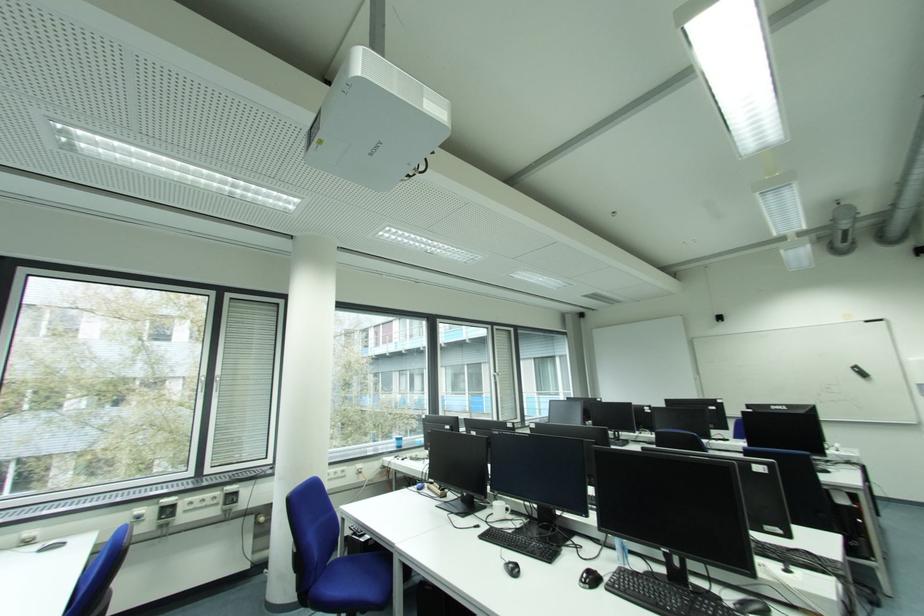
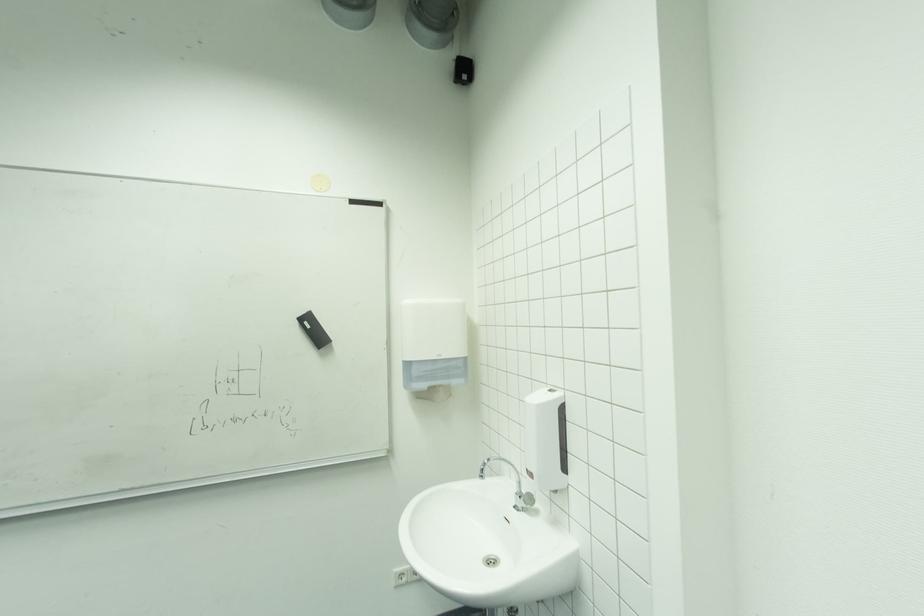
Locate, in the second image, the point that corresponds to [859,369] in the first image.

(307, 321)